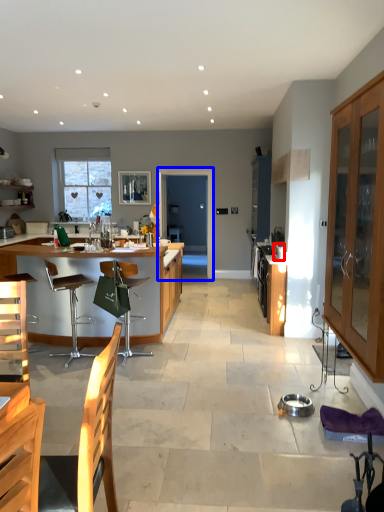
Question: Among these objects, which one is farthest to the camera, appliance (highlighted by a red box) or glass door (highlighted by a blue box)?

Choices:
 (A) appliance
 (B) glass door

Answer: (B)